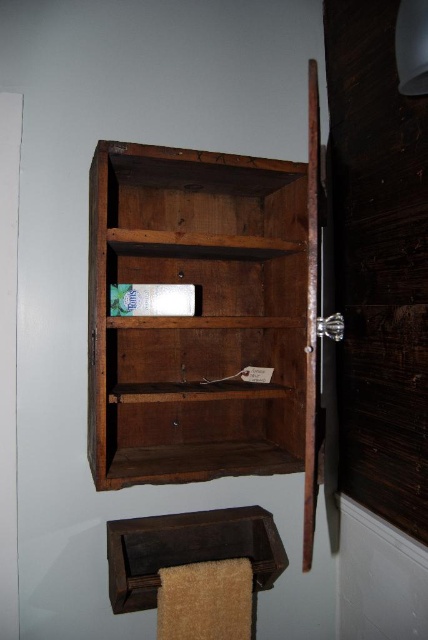
Question: Is wooden bookshelf at center behind dark brown wood towel rack at lower center?

Choices:
 (A) no
 (B) yes

Answer: (A)

Question: Is the position of wooden bookshelf at center more distant than that of dark brown wood towel rack at lower center?

Choices:
 (A) yes
 (B) no

Answer: (B)

Question: Which point is closer to the camera?

Choices:
 (A) wooden bookshelf at center
 (B) dark brown wood towel rack at lower center

Answer: (A)

Question: In this image, where is wooden bookshelf at center located relative to dark brown wood towel rack at lower center?

Choices:
 (A) left
 (B) right

Answer: (B)